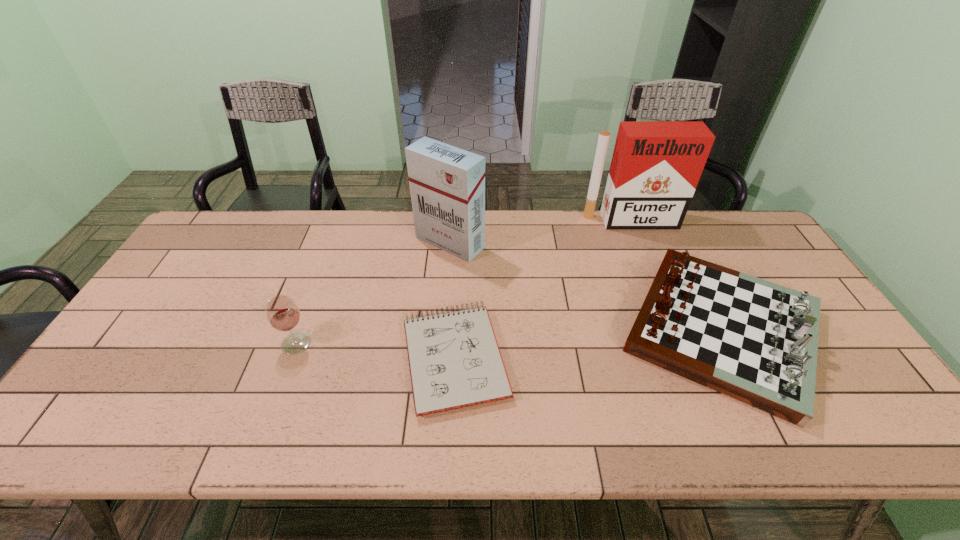
At what (x,y) coordinates should I click in order to perform the action: click on vacant space located 0.310m on the left of the notepad. Please return your answer as a coordinate pair (x, y). Looking at the image, I should click on (277, 357).

This screenshot has width=960, height=540. Identify the location of gameboard that is at the near edge. (755, 341).

This screenshot has height=540, width=960. I want to click on notepad that is at the near edge, so click(454, 359).

I want to click on object located at the right edge, so click(x=755, y=341).

Identify the location of object located in the near right corner section of the desktop. (755, 341).

Identify the location of free region at the far edge of the desktop. This screenshot has width=960, height=540. (584, 222).

Locate an element on the screen. The width and height of the screenshot is (960, 540). vacant point at the near edge is located at coordinates (731, 409).

Where is `free space at the left edge`? This screenshot has width=960, height=540. free space at the left edge is located at coordinates (224, 259).

In the image, there is a desktop. What are the coordinates of `vacant space at the far left corner` in the screenshot? It's located at (225, 251).

What are the coordinates of `free space at the far right corner of the desktop` in the screenshot? It's located at (699, 211).